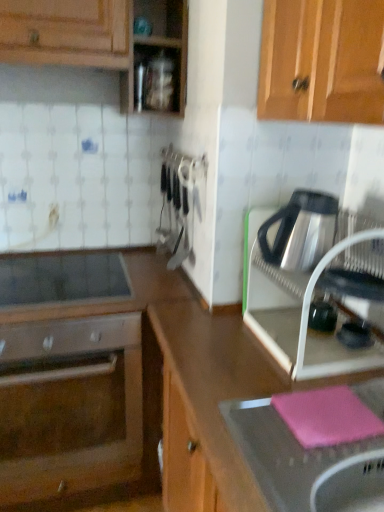
Question: Considering the relative sizes of smooth glass cooktop at center-left and satin silver kettle at right, acting as the 1th kitchen appliance starting from the top, in the image provided, is smooth glass cooktop at center-left smaller than satin silver kettle at right, acting as the 1th kitchen appliance starting from the top,?

Choices:
 (A) yes
 (B) no

Answer: (A)

Question: From the image's perspective, is smooth glass cooktop at center-left beneath satin silver kettle at right, acting as the 1th kitchen appliance starting from the top?

Choices:
 (A) yes
 (B) no

Answer: (A)

Question: Is smooth glass cooktop at center-left positioned with its back to satin silver kettle at right, acting as the 1th kitchen appliance starting from the top?

Choices:
 (A) no
 (B) yes

Answer: (A)

Question: Does smooth glass cooktop at center-left come behind satin silver kettle at right, acting as the 1th kitchen appliance starting from the top?

Choices:
 (A) yes
 (B) no

Answer: (A)

Question: Does smooth glass cooktop at center-left have a larger size compared to satin silver kettle at right, which ranks as the 2th kitchen appliance in bottom-to-top order?

Choices:
 (A) yes
 (B) no

Answer: (B)

Question: Is point (119, 272) positioned closer to the camera than point (299, 232)?

Choices:
 (A) closer
 (B) farther

Answer: (B)

Question: In the image, is smooth glass cooktop at center-left on the left side or the right side of satin silver kettle at right, acting as the 1th kitchen appliance starting from the top?

Choices:
 (A) right
 (B) left

Answer: (B)

Question: Is smooth glass cooktop at center-left bigger or smaller than satin silver kettle at right, acting as the 1th kitchen appliance starting from the top?

Choices:
 (A) small
 (B) big

Answer: (A)

Question: In terms of height, does smooth glass cooktop at center-left look taller or shorter compared to satin silver kettle at right, which ranks as the 2th kitchen appliance in bottom-to-top order?

Choices:
 (A) tall
 (B) short

Answer: (B)

Question: Is satin silver kettle at right, acting as the 1th kitchen appliance starting from the top, inside or outside of satin silver oven at lower left?

Choices:
 (A) outside
 (B) inside

Answer: (A)

Question: Is satin silver kettle at right, which ranks as the 2th kitchen appliance in bottom-to-top order, to the left or to the right of satin silver oven at lower left in the image?

Choices:
 (A) right
 (B) left

Answer: (A)

Question: Is satin silver kettle at right, acting as the 1th kitchen appliance starting from the top, wider or thinner than satin silver oven at lower left?

Choices:
 (A) thin
 (B) wide

Answer: (A)

Question: From the image's perspective, relative to satin silver oven at lower left, is satin silver kettle at right, which ranks as the 2th kitchen appliance in bottom-to-top order, above or below?

Choices:
 (A) above
 (B) below

Answer: (A)

Question: From the image's perspective, is pink rubber mat at lower right above or below satin silver oven at lower left?

Choices:
 (A) above
 (B) below

Answer: (B)

Question: Considering the positions of point (380, 453) and point (122, 433), is point (380, 453) closer or farther from the camera than point (122, 433)?

Choices:
 (A) closer
 (B) farther

Answer: (A)